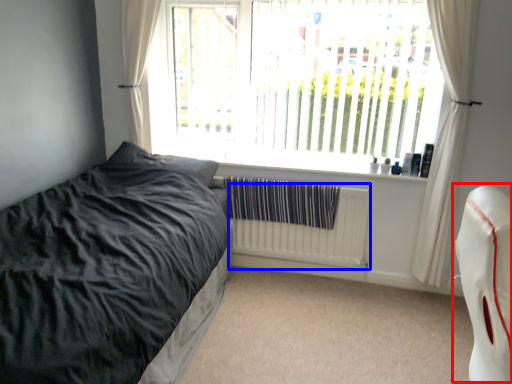
Question: Which of the following is the farthest to the observer, swivel chair (highlighted by a red box) or radiator (highlighted by a blue box)?

Choices:
 (A) swivel chair
 (B) radiator

Answer: (B)